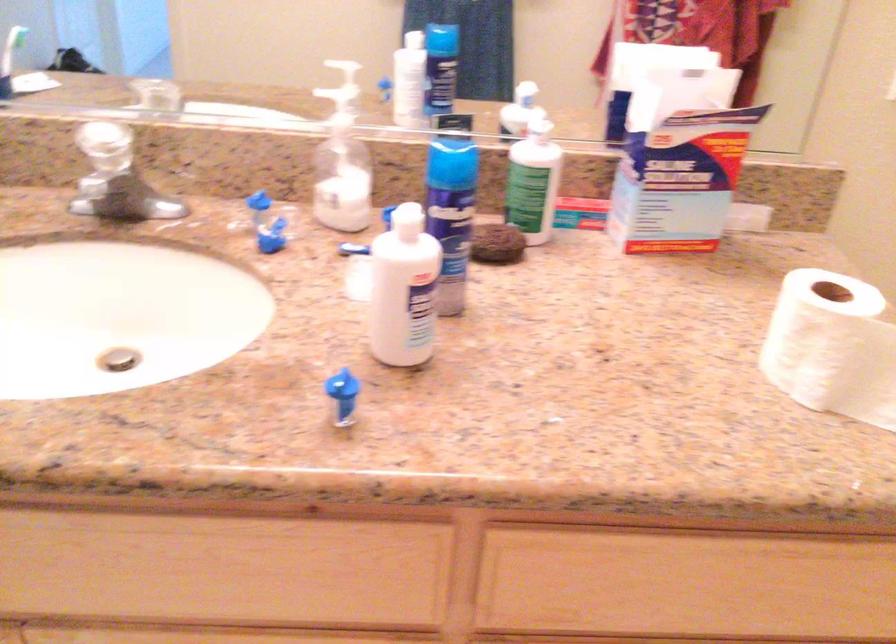
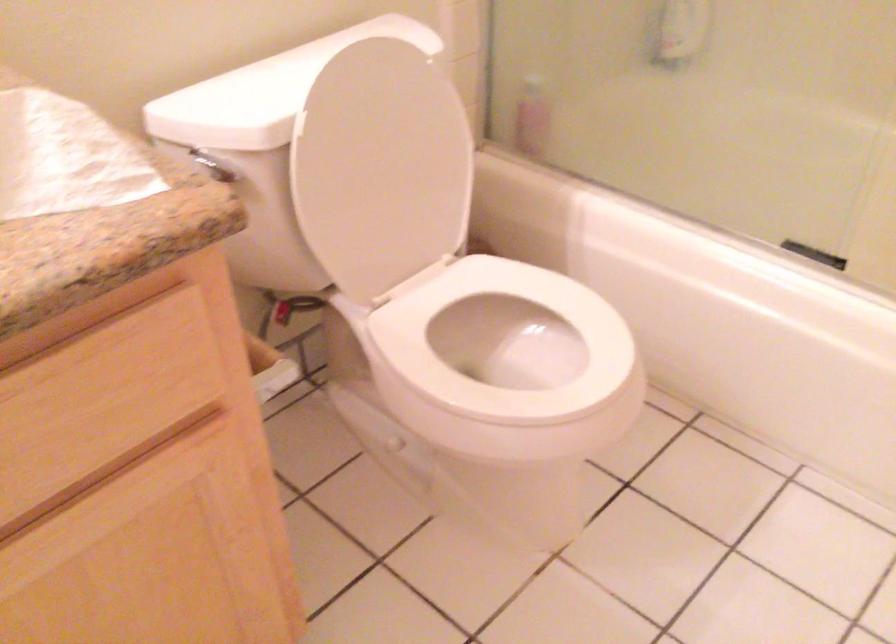
Based on the continuous images, in which direction is the camera rotating?

The camera's rotation is toward right-down.